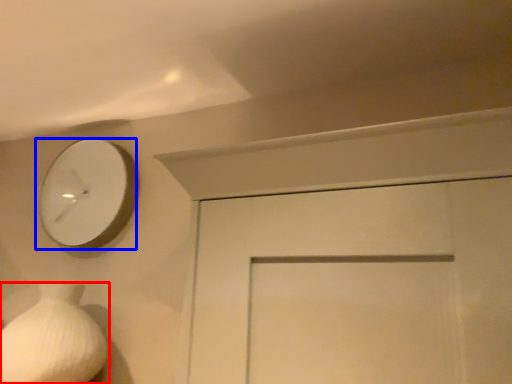
Question: Which of the following is the farthest to the observer, vase (highlighted by a red box) or wall clock (highlighted by a blue box)?

Choices:
 (A) vase
 (B) wall clock

Answer: (B)